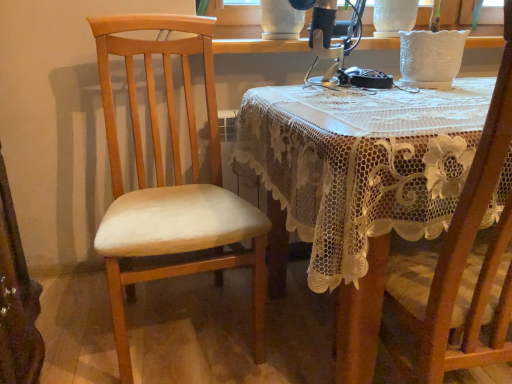
Question: Considering the relative sizes of lacy fabric table at center and metallic silver sewing machine at upper center in the image provided, is lacy fabric table at center shorter than metallic silver sewing machine at upper center?

Choices:
 (A) yes
 (B) no

Answer: (B)

Question: Is lacy fabric table at center not close to metallic silver sewing machine at upper center?

Choices:
 (A) no
 (B) yes

Answer: (A)

Question: Is lacy fabric table at center at the right side of metallic silver sewing machine at upper center?

Choices:
 (A) yes
 (B) no

Answer: (A)

Question: Can you confirm if lacy fabric table at center is smaller than metallic silver sewing machine at upper center?

Choices:
 (A) yes
 (B) no

Answer: (B)

Question: Considering the relative sizes of lacy fabric table at center and metallic silver sewing machine at upper center in the image provided, is lacy fabric table at center bigger than metallic silver sewing machine at upper center?

Choices:
 (A) yes
 (B) no

Answer: (A)

Question: From a real-world perspective, is light wood chair at left, the second chair viewed from the right, above or below lacy fabric table at center?

Choices:
 (A) below
 (B) above

Answer: (B)

Question: Considering their positions, is light wood chair at left, the second chair viewed from the right, located in front of or behind lacy fabric table at center?

Choices:
 (A) behind
 (B) front

Answer: (A)

Question: Looking at the image, does light wood chair at left, the 1th chair viewed from the left, seem bigger or smaller compared to lacy fabric table at center?

Choices:
 (A) small
 (B) big

Answer: (A)

Question: From the image's perspective, is light wood chair at left, the second chair viewed from the right, positioned above or below lacy fabric table at center?

Choices:
 (A) below
 (B) above

Answer: (B)

Question: In terms of height, does wooden chair at right, arranged as the 1th chair when viewed from the right, look taller or shorter compared to light wood chair at left, the second chair viewed from the right?

Choices:
 (A) tall
 (B) short

Answer: (B)

Question: Is wooden chair at right, arranged as the 1th chair when viewed from the right, situated inside light wood chair at left, the 1th chair viewed from the left, or outside?

Choices:
 (A) outside
 (B) inside

Answer: (A)

Question: In the image, is wooden chair at right, placed as the 2th chair when sorted from left to right, positioned in front of or behind light wood chair at left, the second chair viewed from the right?

Choices:
 (A) front
 (B) behind

Answer: (A)

Question: From a real-world perspective, relative to light wood chair at left, the 1th chair viewed from the left, is wooden chair at right, arranged as the 1th chair when viewed from the right, vertically above or below?

Choices:
 (A) above
 (B) below

Answer: (B)

Question: Looking at their shapes, would you say light wood chair at left, the second chair viewed from the right, is wider or thinner than white textured vase at upper center?

Choices:
 (A) wide
 (B) thin

Answer: (A)

Question: Considering the positions of point (157, 168) and point (206, 11), is point (157, 168) closer or farther from the camera than point (206, 11)?

Choices:
 (A) closer
 (B) farther

Answer: (A)